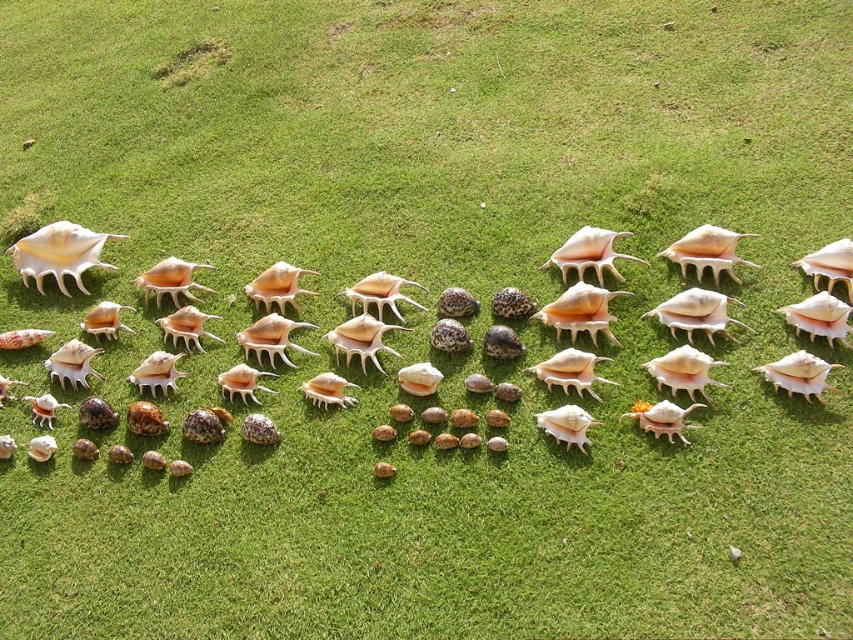
Does translucent white seashell at center have a lesser width compared to shiny beige seashell at center?

No, translucent white seashell at center is not thinner than shiny beige seashell at center.

Can you confirm if translucent white seashell at center is positioned above shiny beige seashell at center?

No.

Image resolution: width=853 pixels, height=640 pixels. Find the location of `translucent white seashell at center`. translucent white seashell at center is located at coordinates (71, 364).

Does translucent white seashell at center appear on the right side of matte white shell at upper left?

Correct, you'll find translucent white seashell at center to the right of matte white shell at upper left.

Does translucent white seashell at center come behind matte white shell at upper left?

No.

Where is `translucent white seashell at center`? translucent white seashell at center is located at coordinates (71, 364).

Is matte white shell at upper left positioned before shiny beige seashell at center?

No, it is behind shiny beige seashell at center.

Between matte white shell at upper left and shiny beige seashell at center, which one is positioned higher?

matte white shell at upper left is higher up.

Is point (79, 234) positioned behind point (567, 240)?

That is True.

The width and height of the screenshot is (853, 640). What are the coordinates of `matte white shell at upper left` in the screenshot? It's located at (59, 253).